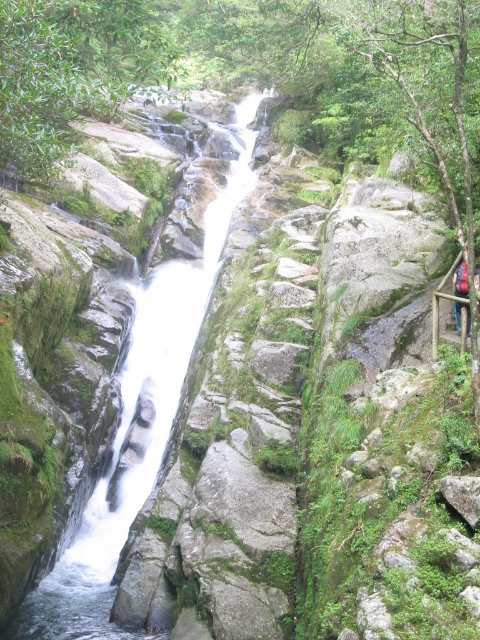
You are hiking and see the white smooth stream at center and the camouflage fabric backpack at right. Which object is taller?

The white smooth stream at center is much taller than the camouflage fabric backpack at right.

You are standing at the edge of the canyon looking towards the waterfall. There is a point marked at coordinates point (133, 413). What is located at this point?

The white smooth stream at center is located at point (133, 413).